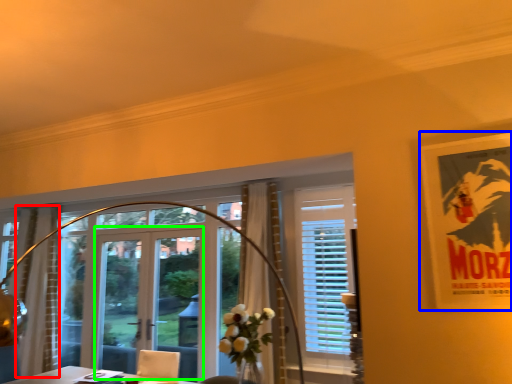
Question: Which object is positioned closest to curtain (highlighted by a red box)? Select from poster page (highlighted by a blue box) and screen door (highlighted by a green box).

Choices:
 (A) poster page
 (B) screen door

Answer: (B)